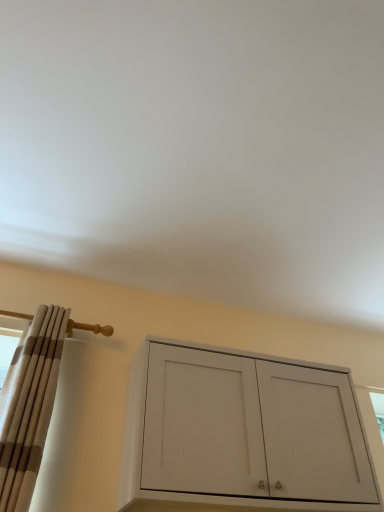
This screenshot has width=384, height=512. Describe the element at coordinates (243, 432) in the screenshot. I see `white matte cabinet at center` at that location.

Looking at this image, in order to face white matte cabinet at center, should I rotate leftwards or rightwards?

You should rotate right by 7.658 degrees.

At what (x,y) coordinates should I click in order to perform the action: click on white matte cabinet at center. Please return your answer as a coordinate pair (x, y). Looking at the image, I should click on (243, 432).

Image resolution: width=384 pixels, height=512 pixels. What do you see at coordinates (31, 408) in the screenshot?
I see `beige striped curtain at left` at bounding box center [31, 408].

What is the approximate height of beige striped curtain at left?

The height of beige striped curtain at left is 31.93 inches.

Where is `beige striped curtain at left`? beige striped curtain at left is located at coordinates (31, 408).

Image resolution: width=384 pixels, height=512 pixels. Identify the location of white matte cabinet at center. (243, 432).

Is beige striped curtain at left to the left of white matte cabinet at center from the viewer's perspective?

Yes.

Between beige striped curtain at left and white matte cabinet at center, which one is positioned behind?

white matte cabinet at center is further away from the camera.

Is point (2, 464) positioned before point (126, 501)?

No, it is behind (126, 501).

From the image's perspective, is beige striped curtain at left over white matte cabinet at center?

Correct, beige striped curtain at left appears higher than white matte cabinet at center in the image.

Consider the image. From a real-world perspective, is beige striped curtain at left physically located above or below white matte cabinet at center?

beige striped curtain at left is above white matte cabinet at center.

Considering the relative sizes of beige striped curtain at left and white matte cabinet at center in the image provided, is beige striped curtain at left thinner than white matte cabinet at center?

Yes, beige striped curtain at left is thinner than white matte cabinet at center.

Considering the relative sizes of beige striped curtain at left and white matte cabinet at center in the image provided, is beige striped curtain at left shorter than white matte cabinet at center?

In fact, beige striped curtain at left may be taller than white matte cabinet at center.

Considering the relative sizes of beige striped curtain at left and white matte cabinet at center in the image provided, is beige striped curtain at left bigger than white matte cabinet at center?

Actually, beige striped curtain at left might be smaller than white matte cabinet at center.

Is beige striped curtain at left spatially inside white matte cabinet at center, or outside of it?

The correct answer is: outside.

Is beige striped curtain at left in contact with white matte cabinet at center?

beige striped curtain at left and white matte cabinet at center are clearly separated.

Is beige striped curtain at left looking in the opposite direction of white matte cabinet at center?

beige striped curtain at left does not have its back to white matte cabinet at center.

Find the location of `cabinetry on the right side of beige striped curtain at left`. cabinetry on the right side of beige striped curtain at left is located at coordinates (243, 432).

From the picture: Considering the relative positions of white matte cabinet at center and beige striped curtain at left in the image provided, is white matte cabinet at center to the left or to the right of beige striped curtain at left?

Clearly, white matte cabinet at center is on the right of beige striped curtain at left in the image.

Is white matte cabinet at center in front of or behind beige striped curtain at left in the image?

white matte cabinet at center is behind beige striped curtain at left.

Does point (291, 379) appear closer or farther from the camera than point (52, 366)?

Point (291, 379) appears to be farther away from the viewer than point (52, 366).

From the picture: From the image's perspective, which is above, white matte cabinet at center or beige striped curtain at left?

beige striped curtain at left is shown above in the image.

From a real-world perspective, is white matte cabinet at center under beige striped curtain at left?

Indeed, from a real-world perspective, white matte cabinet at center is positioned beneath beige striped curtain at left.

Considering the sizes of objects white matte cabinet at center and beige striped curtain at left in the image provided, who is thinner, white matte cabinet at center or beige striped curtain at left?

beige striped curtain at left is thinner.

Based on the photo, considering the sizes of objects white matte cabinet at center and beige striped curtain at left in the image provided, who is taller, white matte cabinet at center or beige striped curtain at left?

beige striped curtain at left is taller.

Who is bigger, white matte cabinet at center or beige striped curtain at left?

white matte cabinet at center.

Is beige striped curtain at left inside white matte cabinet at center?

No, beige striped curtain at left is located outside of white matte cabinet at center.

Is white matte cabinet at center directly adjacent to beige striped curtain at left?

There is a gap between white matte cabinet at center and beige striped curtain at left.

Is white matte cabinet at center facing away from beige striped curtain at left?

No, white matte cabinet at center is not facing away from beige striped curtain at left.

How many degrees apart are the facing directions of white matte cabinet at center and beige striped curtain at left?

There is a 0.000319-degree angle between the facing directions of white matte cabinet at center and beige striped curtain at left.

You are a GUI agent. You are given a task and a screenshot of the screen. Output one action in this format:
    pyautogui.click(x=<x>, y=<y>)
    Task: Click on the cabinetry behind the beige striped curtain at left
    Image resolution: width=384 pixels, height=512 pixels.
    Given the screenshot: What is the action you would take?
    pyautogui.click(x=243, y=432)

At what (x,y) coordinates should I click in order to perform the action: click on curtain above the white matte cabinet at center (from the image's perspective). Please return your answer as a coordinate pair (x, y). This screenshot has height=512, width=384. Looking at the image, I should click on (31, 408).

Locate an element on the screen. Image resolution: width=384 pixels, height=512 pixels. cabinetry located on the right of beige striped curtain at left is located at coordinates (243, 432).